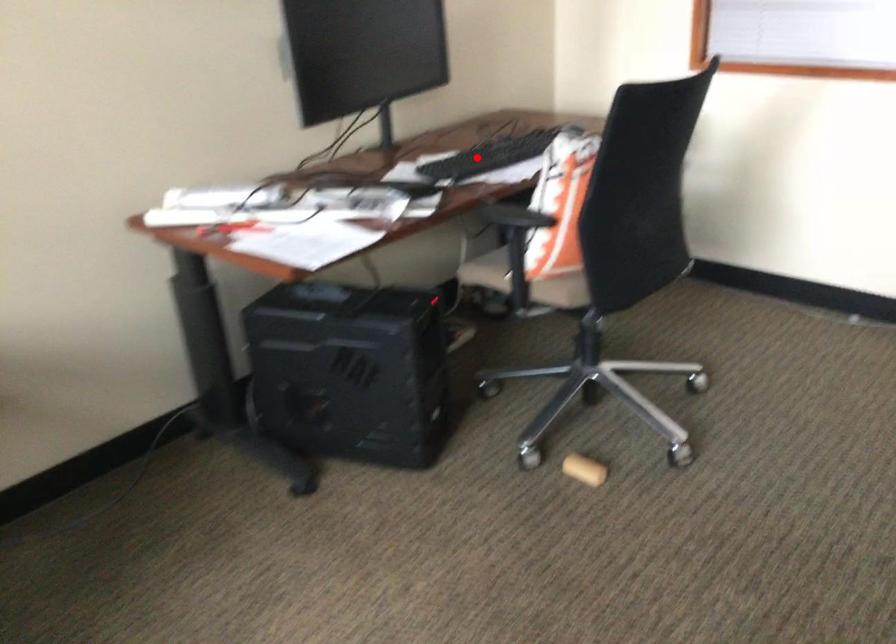
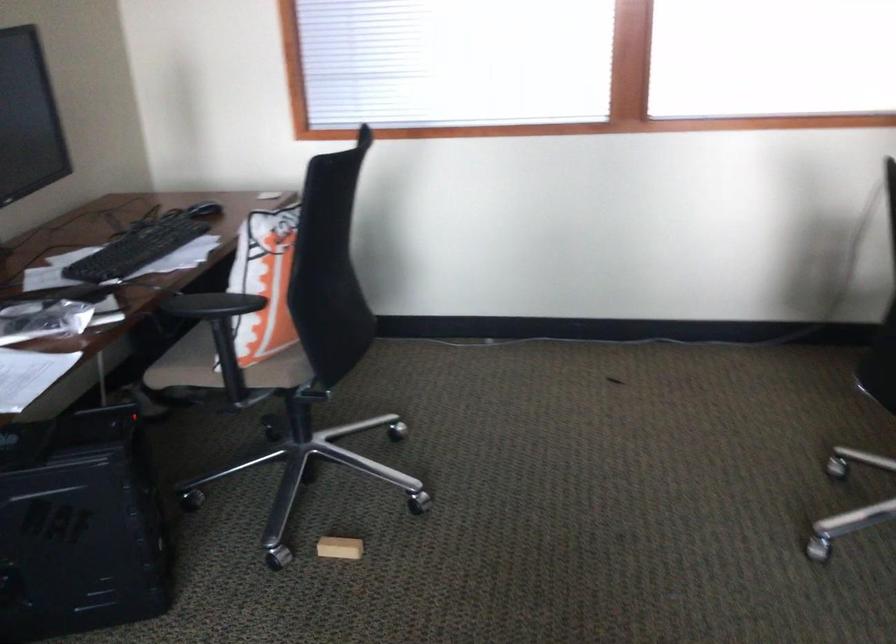
Question: I am providing you with two images of the same scene from different viewpoints. Given a red point in image1, look at the same physical point in image2. Is it:

Choices:
 (A) Closer to the viewpoint
 (B) Farther from the viewpoint

Answer: (A)